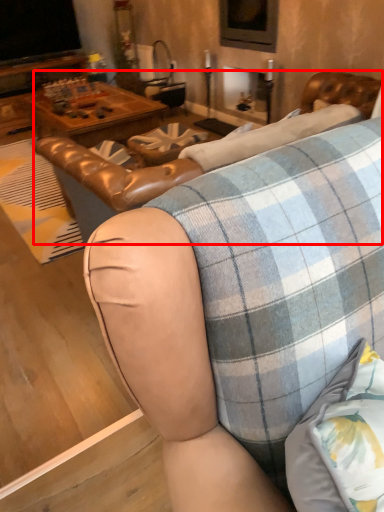
Question: From the image, what is the correct spatial relationship of swivel chair (annotated by the red box) in relation to studio couch?

Choices:
 (A) right
 (B) left

Answer: (A)